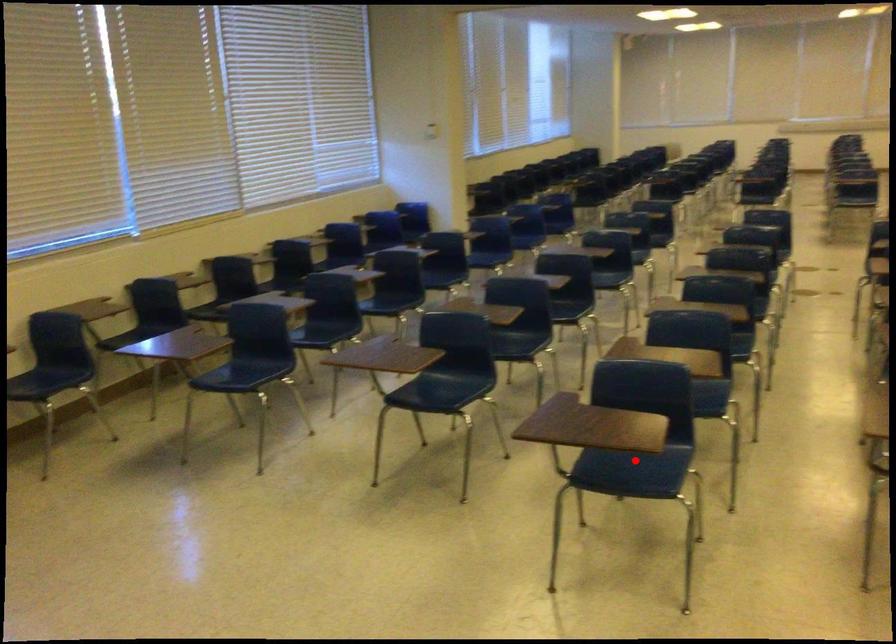
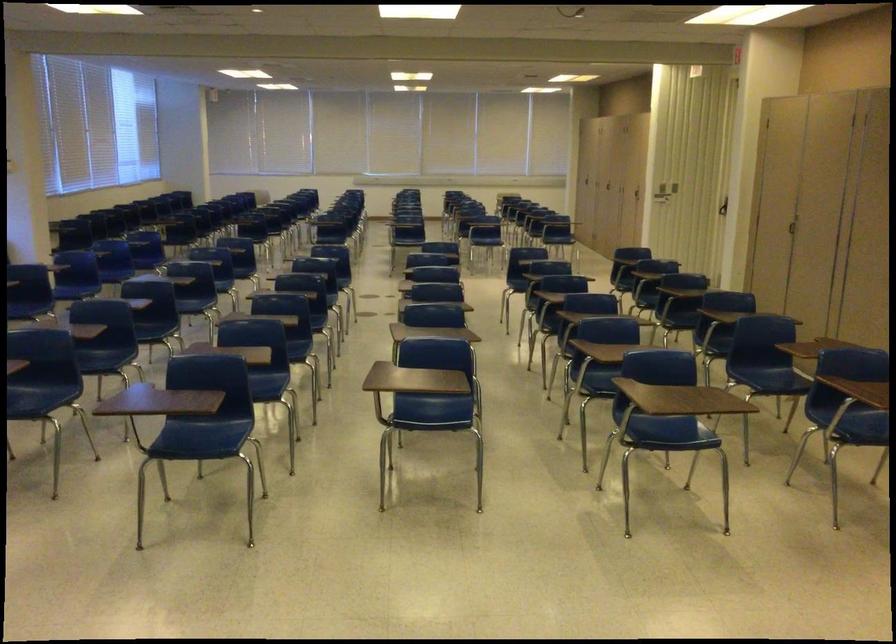
Question: I am providing you with two images of the same scene from different viewpoints. Image1 has a red point marked. In image2, the corresponding 3D location appears at what relative position? Reply with the corresponding letter.

Choices:
 (A) Closer
 (B) Farther

Answer: (B)